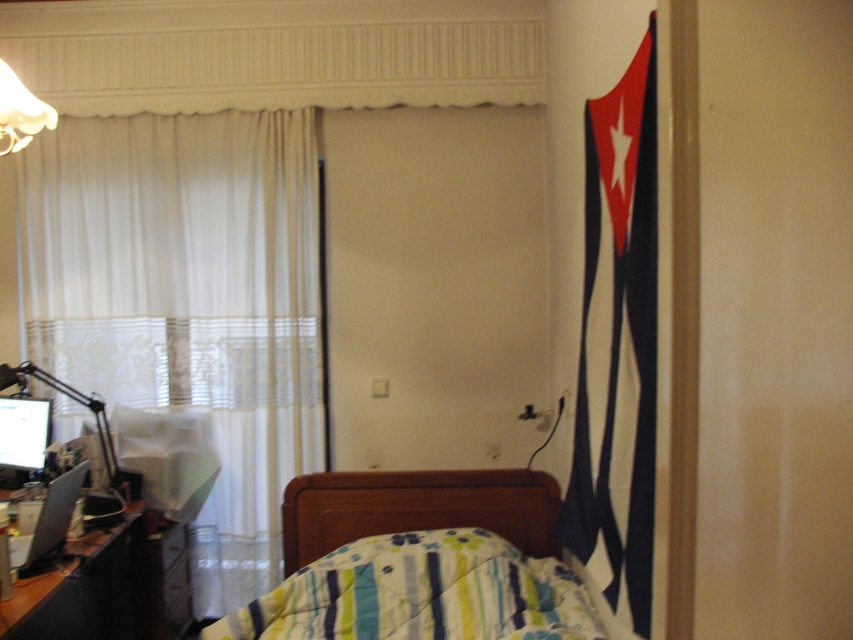
In the scene shown: You are standing in a bedroom and want to check the distance to the white sheer curtain at left. If your eyes are at 1.7 meters height, can you see the curtain clearly without moving closer?

The white sheer curtain at left is 3.49 meters away from the viewer. Since sheer curtains are typically translucent and allow light to pass through, you can likely see it clearly from that distance as long as there are no obstructions between you and the curtain.

You are organizing a photo shoot in the bedroom and need to position a model between the white sheer curtain at left and the striped fabric bed at lower center. Based on their positions, which object is closer to the left wall?

The white sheer curtain at left is closer to the left wall since it is positioned on the left side of the striped fabric bed at lower center.

You are a painter who wants to hang a 1.2 meter wide painting on the wall behind the white sheer curtain at left and wooden desk at lower left. Which location has enough space for the painting?

The white sheer curtain at left is wider than the wooden desk at lower left, so the painting can be hung behind the white sheer curtain at left but not behind the wooden desk at lower left.